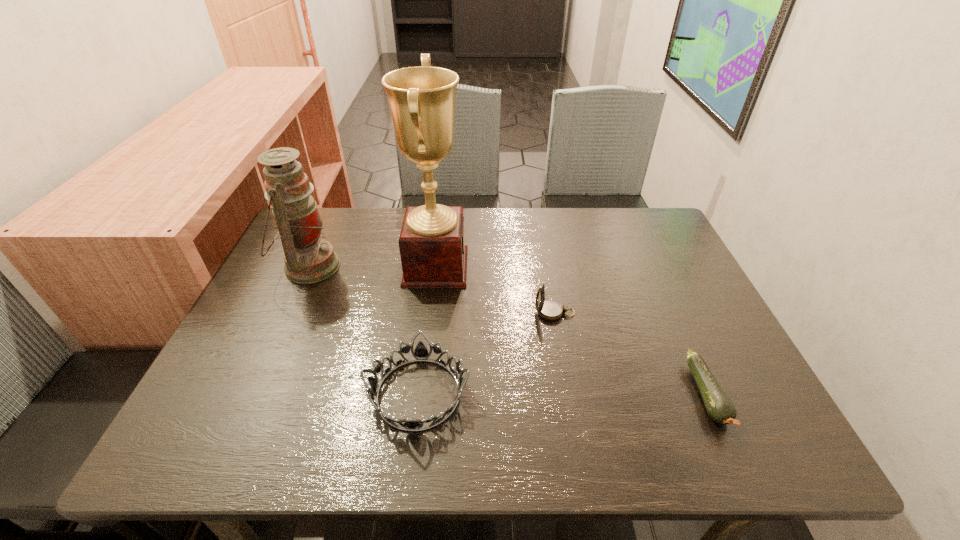
In order to click on empty space between the leftmost object and the rightmost object in this screenshot , I will do `click(508, 331)`.

The image size is (960, 540). Identify the location of free space between the third farthest object and the zucchini. (631, 354).

Locate an element on the screen. The image size is (960, 540). unoccupied area between the second object from right to left and the second tallest object is located at coordinates click(432, 289).

Image resolution: width=960 pixels, height=540 pixels. In order to click on vacant space that is in between the zucchini and the tallest object in this screenshot , I will do `click(571, 331)`.

This screenshot has width=960, height=540. Identify the location of free space between the second tallest object and the tallest object. (372, 267).

Where is `empty space between the tiara and the tallest object`? This screenshot has height=540, width=960. empty space between the tiara and the tallest object is located at coordinates (427, 330).

Find the location of `free space that is in between the fourth shortest object and the tiara`. free space that is in between the fourth shortest object and the tiara is located at coordinates (364, 330).

At what (x,y) coordinates should I click in order to perform the action: click on free space between the compass and the second tallest object. Please return your answer as a coordinate pair (x, y). Looking at the image, I should click on (432, 289).

Identify the location of the third closest object to the tiara. (308, 259).

The height and width of the screenshot is (540, 960). I want to click on object that is the third nearest to the fourth object from left to right, so click(x=719, y=406).